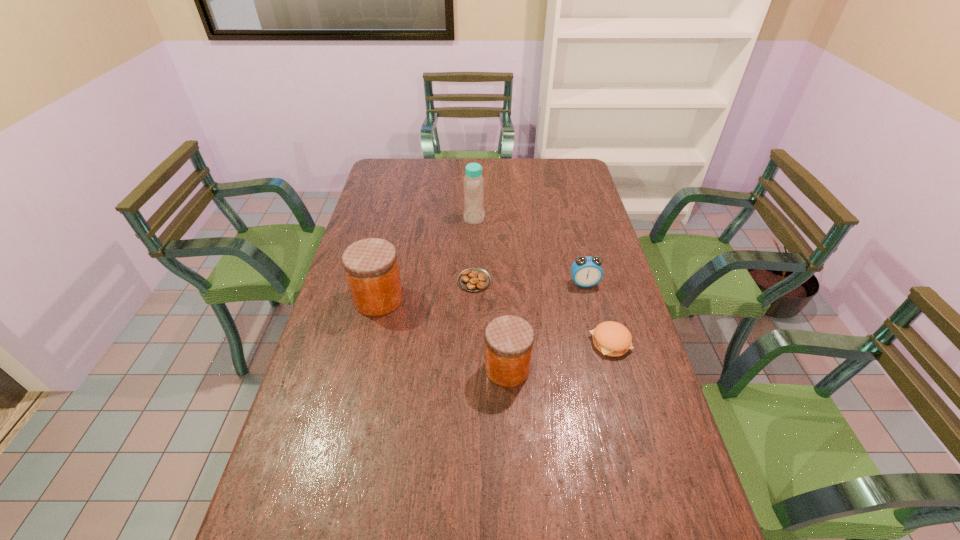
The width and height of the screenshot is (960, 540). Find the location of `free spot between the fifth tallest object and the pastry`. free spot between the fifth tallest object and the pastry is located at coordinates (542, 312).

Point out which object is positioned as the second nearest to the pastry. Please provide its 2D coordinates. Your answer should be formatted as a tuple, i.e. [(x, y)], where the tuple contains the x and y coordinates of a point satisfying the conditions above.

[(509, 339)]

Point out which object is positioned as the second nearest to the fourth tallest object. Please provide its 2D coordinates. Your answer should be formatted as a tuple, i.e. [(x, y)], where the tuple contains the x and y coordinates of a point satisfying the conditions above.

[(474, 279)]

What are the coordinates of `vacant space that satisfies the following two spatial constraints: 1. on the face of the fifth tallest object; 2. on the right side of the alarm clock` in the screenshot? It's located at (599, 342).